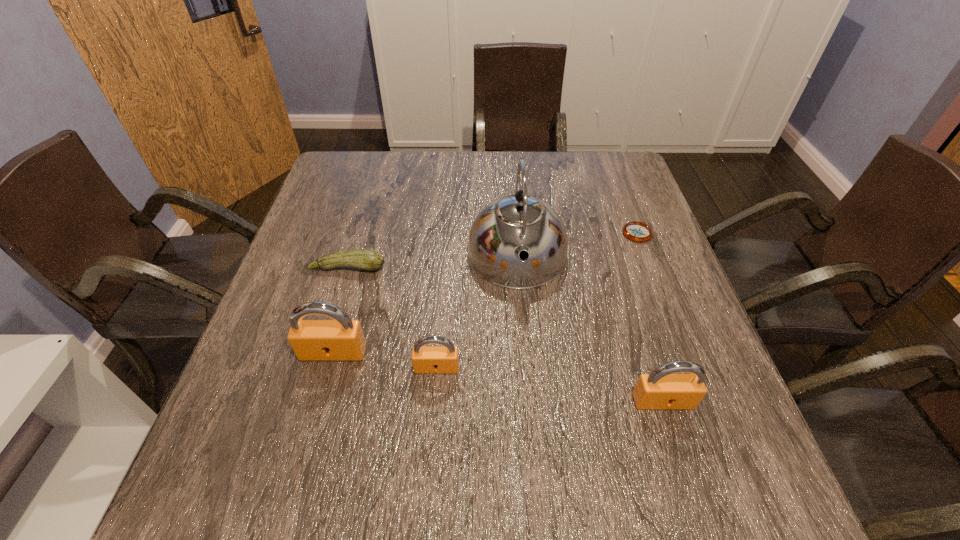
Identify the location of padlock that stands as the second closest to the nearest object. The height and width of the screenshot is (540, 960). (342, 339).